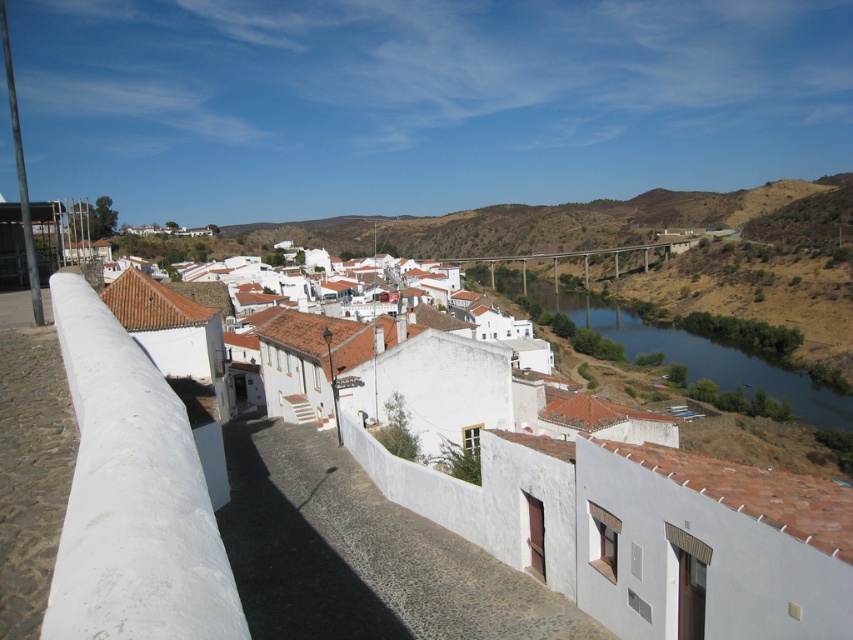
Question: From the image, what is the correct spatial relationship of blue smooth water at center in relation to matte concrete bridge at center?

Choices:
 (A) below
 (B) above

Answer: (A)

Question: Is blue smooth water at center above matte concrete bridge at center?

Choices:
 (A) yes
 (B) no

Answer: (B)

Question: In this image, where is blue smooth water at center located relative to matte concrete bridge at center?

Choices:
 (A) below
 (B) above

Answer: (A)